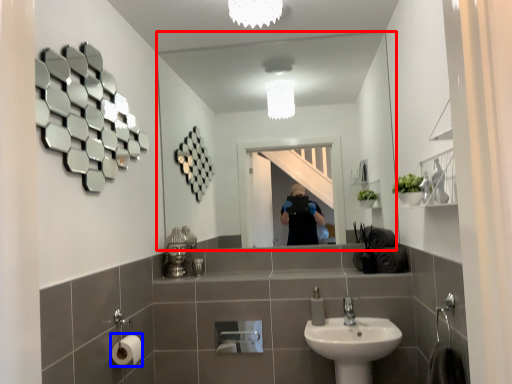
Question: Which point is closer to the camera, mirror (highlighted by a red box) or toilet paper (highlighted by a blue box)?

Choices:
 (A) mirror
 (B) toilet paper

Answer: (B)